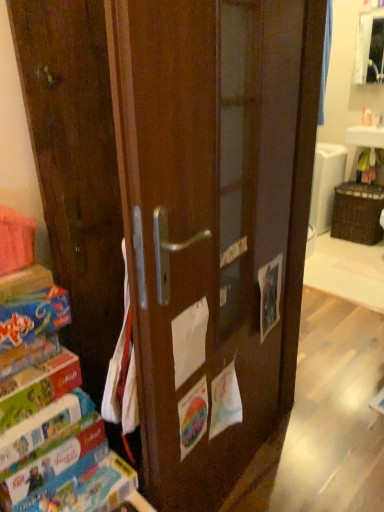
Question: Is point (19, 327) closer or farther from the camera than point (39, 389)?

Choices:
 (A) closer
 (B) farther

Answer: (A)

Question: Would you say matte cardboard book at left, the fourth paperback book in the bottom-to-top sequence, is inside or outside matte cardboard book at lower left, arranged as the third paperback book when ordered from the bottom?

Choices:
 (A) inside
 (B) outside

Answer: (B)

Question: Estimate the real-world distances between objects in this image. Which object is closer to the hardcover book at left, which ranks as the fourth paperback book in top-to-bottom order?

Choices:
 (A) matte cardboard book at lower left, positioned as the 2th paperback book in top-to-bottom order
 (B) matte cardboard book at lower left, arranged as the third paperback book when viewed from the top
 (C) matte cardboard book at left, which is counted as the 1th paperback book, starting from the top
 (D) matte brown cabinet at upper right

Answer: (B)

Question: Considering the real-world distances, which object is farthest from the matte brown cabinet at upper right?

Choices:
 (A) matte cardboard book at lower left, arranged as the third paperback book when ordered from the bottom
 (B) hardcover book at left, which is the 1th paperback book in bottom-to-top order
 (C) matte cardboard book at lower left, arranged as the third paperback book when viewed from the top
 (D) matte cardboard book at left, the fourth paperback book in the bottom-to-top sequence

Answer: (B)